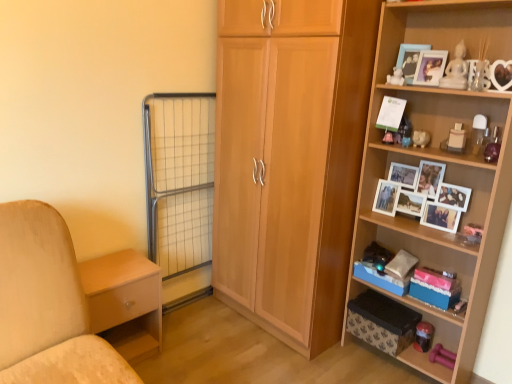
The image size is (512, 384). I want to click on spots to the right of metal grid screen door at lower left, so click(x=219, y=316).